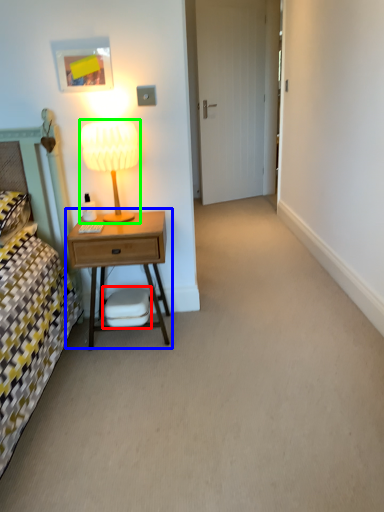
Question: Which object is positioned farthest from swivel chair (highlighted by a red box)? Select from nightstand (highlighted by a blue box) and table lamp (highlighted by a green box).

Choices:
 (A) nightstand
 (B) table lamp

Answer: (B)